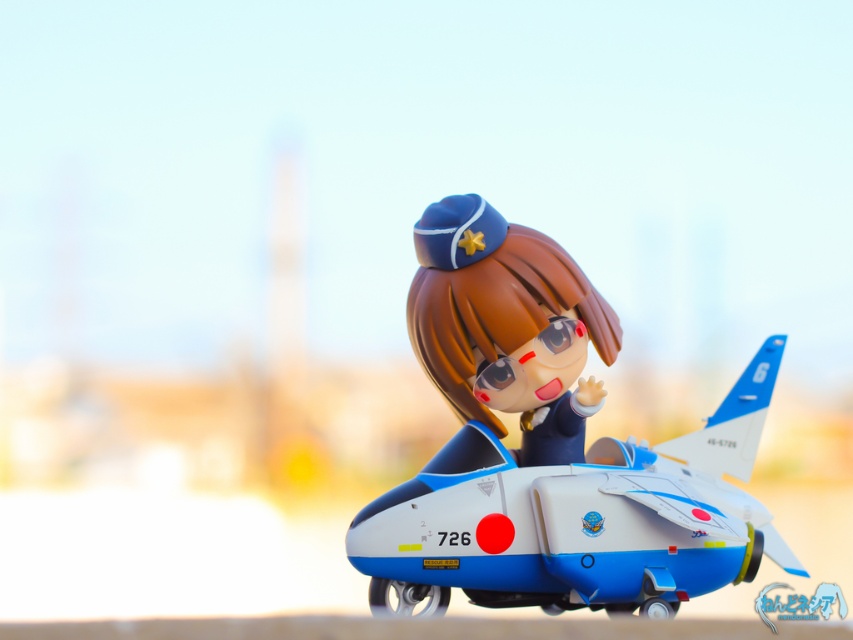
How far apart are blue plastic airplane at center and satin blue uniform at center?

They are 2.37 inches apart.

Who is positioned more to the right, blue plastic airplane at center or satin blue uniform at center?

blue plastic airplane at center

Is point (746, 570) behind point (416, 330)?

That is False.

Identify the location of blue plastic airplane at center. (577, 518).